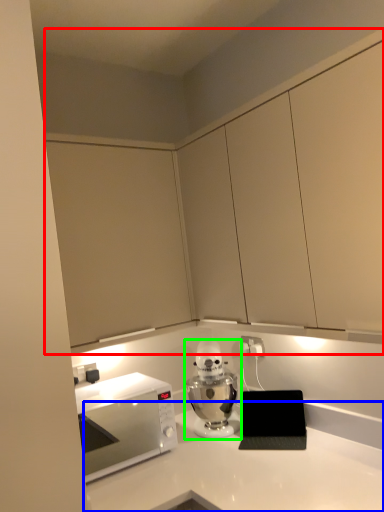
Question: Considering the real-world distances, which object is closest to cabinetry (highlighted by a red box)? countertop (highlighted by a blue box) or home appliance (highlighted by a green box).

Choices:
 (A) countertop
 (B) home appliance

Answer: (B)